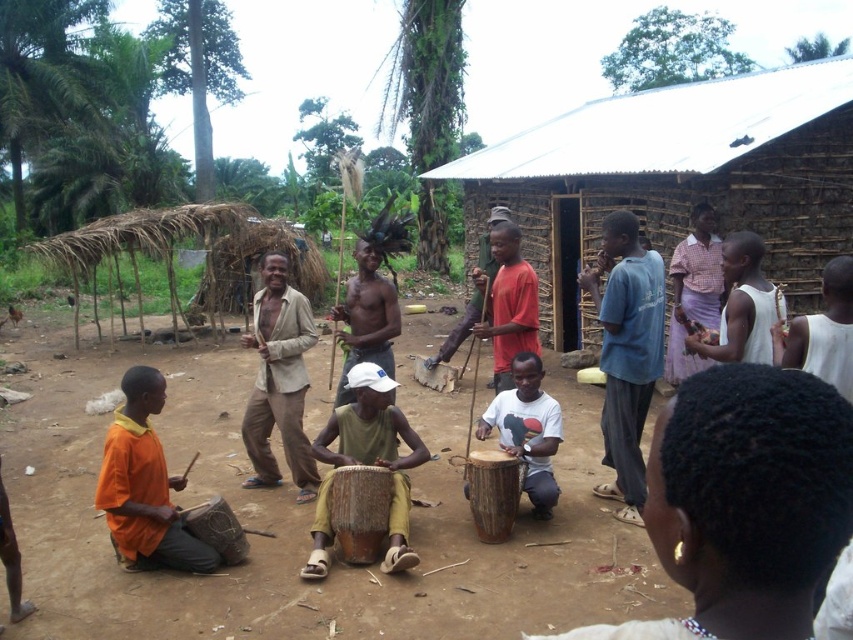
You are a photographer standing in front of the scene and want to capture both the plaid fabric shirt at center and the matte red shirt at center in a single photo. Which shirt should you focus on to ensure both are in clear focus?

To ensure both the plaid fabric shirt at center and the matte red shirt at center are in clear focus, focus on the plaid fabric shirt at center since it is closer to you than the matte red shirt at center, creating a greater depth of field for both subjects.

You are a photographer trying to capture a closeup of the shiny skin at center and the matte red drum at center. Since the shiny skin is above the matte red drum, which object should you focus on first to ensure both are in focus?

Since the shiny skin at center is located above the matte red drum at center, you should focus on the matte red drum at center first because it is closer to the camera. This way, both objects will be in focus as the shiny skin at center is further away.